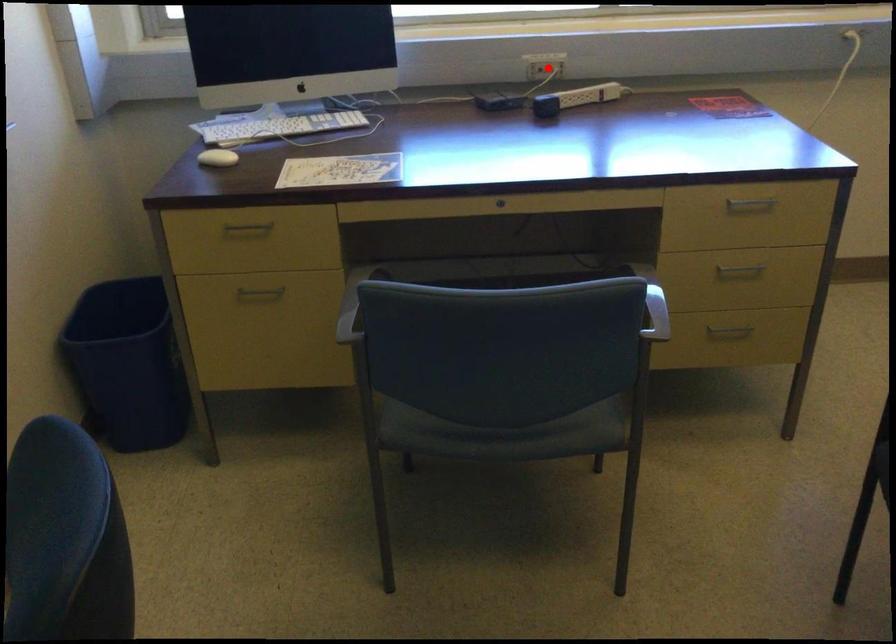
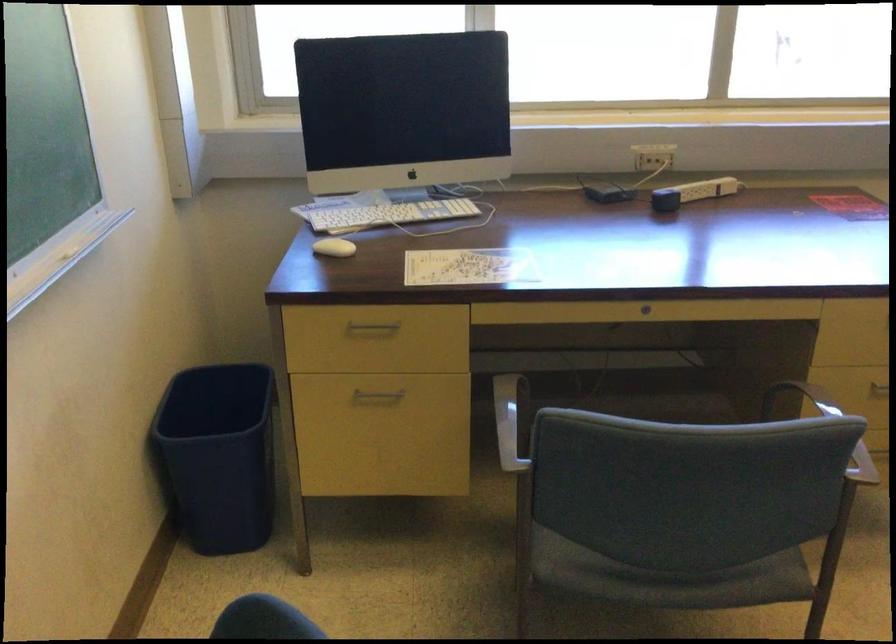
Find the pixel in the second image that matches the highlighted location in the first image.

(658, 156)